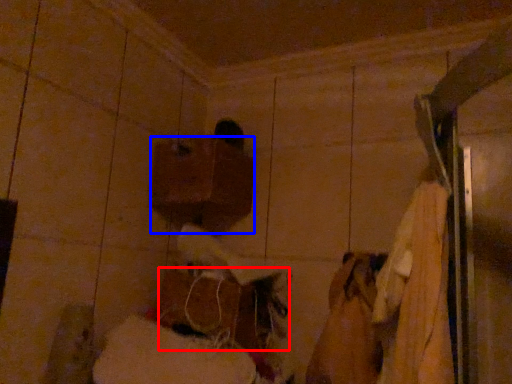
Question: Which of the following is the farthest to the observer, wood (highlighted by a red box) or wood (highlighted by a blue box)?

Choices:
 (A) wood
 (B) wood

Answer: (B)